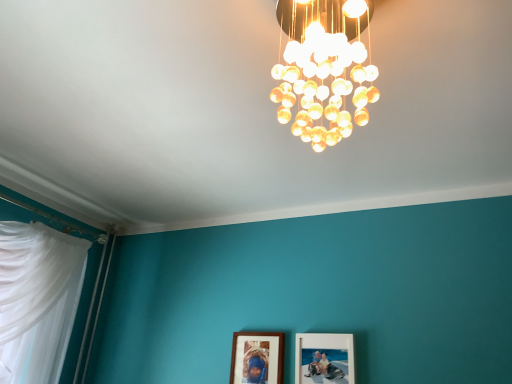
The height and width of the screenshot is (384, 512). Describe the element at coordinates (257, 357) in the screenshot. I see `wooden picture frame at center, the first picture frame when ordered from left to right` at that location.

This screenshot has height=384, width=512. I want to click on matte wooden picture frame at lower center, which appears as the second picture frame when viewed from the left, so click(x=324, y=356).

How many degrees apart are the facing directions of wooden picture frame at center, acting as the 2th picture frame starting from the right, and translucent glass chandelier at upper center?

The angular difference between wooden picture frame at center, acting as the 2th picture frame starting from the right, and translucent glass chandelier at upper center is 86.1 degrees.

Is wooden picture frame at center, the first picture frame when ordered from left to right, aimed at translucent glass chandelier at upper center?

No, wooden picture frame at center, the first picture frame when ordered from left to right, is not oriented towards translucent glass chandelier at upper center.

Which object is positioned more to the right, wooden picture frame at center, the first picture frame when ordered from left to right, or translucent glass chandelier at upper center?

From the viewer's perspective, translucent glass chandelier at upper center appears more on the right side.

From the image's perspective, is wooden picture frame at center, the first picture frame when ordered from left to right, beneath matte wooden picture frame at lower center, which is counted as the first picture frame, starting from the right?

Indeed, from the image's perspective, wooden picture frame at center, the first picture frame when ordered from left to right, is shown beneath matte wooden picture frame at lower center, which is counted as the first picture frame, starting from the right.

Is point (234, 334) closer or farther from the camera than point (342, 369)?

Point (234, 334).

Considering the positions of objects wooden picture frame at center, the first picture frame when ordered from left to right, and matte wooden picture frame at lower center, which appears as the second picture frame when viewed from the left, in the image provided, who is more to the right, wooden picture frame at center, the first picture frame when ordered from left to right, or matte wooden picture frame at lower center, which appears as the second picture frame when viewed from the left,?

From the viewer's perspective, matte wooden picture frame at lower center, which appears as the second picture frame when viewed from the left, appears more on the right side.

Is wooden picture frame at center, acting as the 2th picture frame starting from the right, located within matte wooden picture frame at lower center, which appears as the second picture frame when viewed from the left?

No, matte wooden picture frame at lower center, which appears as the second picture frame when viewed from the left, does not contain wooden picture frame at center, acting as the 2th picture frame starting from the right.

Is matte wooden picture frame at lower center, which appears as the second picture frame when viewed from the left, facing towards wooden picture frame at center, acting as the 2th picture frame starting from the right?

No.

Is matte wooden picture frame at lower center, which is counted as the first picture frame, starting from the right, smaller than wooden picture frame at center, the first picture frame when ordered from left to right?

Actually, matte wooden picture frame at lower center, which is counted as the first picture frame, starting from the right, might be larger than wooden picture frame at center, the first picture frame when ordered from left to right.

From a real-world perspective, is matte wooden picture frame at lower center, which appears as the second picture frame when viewed from the left, physically below wooden picture frame at center, the first picture frame when ordered from left to right?

No.

Between translucent glass chandelier at upper center and matte wooden picture frame at lower center, which is counted as the first picture frame, starting from the right, which one is positioned in front?

translucent glass chandelier at upper center is closer to the camera.

From a real-world perspective, is translucent glass chandelier at upper center on top of matte wooden picture frame at lower center, which is counted as the first picture frame, starting from the right?

Yes, from a real-world perspective, translucent glass chandelier at upper center is over matte wooden picture frame at lower center, which is counted as the first picture frame, starting from the right

Would you say translucent glass chandelier at upper center is inside or outside matte wooden picture frame at lower center, which appears as the second picture frame when viewed from the left?

translucent glass chandelier at upper center lies outside matte wooden picture frame at lower center, which appears as the second picture frame when viewed from the left.

How different are the orientations of translucent glass chandelier at upper center and matte wooden picture frame at lower center, which appears as the second picture frame when viewed from the left, in degrees?

The angle between the facing direction of translucent glass chandelier at upper center and the facing direction of matte wooden picture frame at lower center, which appears as the second picture frame when viewed from the left, is 86.6 degrees.

Considering the relative sizes of matte wooden picture frame at lower center, which appears as the second picture frame when viewed from the left, and translucent glass chandelier at upper center in the image provided, is matte wooden picture frame at lower center, which appears as the second picture frame when viewed from the left, smaller than translucent glass chandelier at upper center?

Yes.

From a real-world perspective, is matte wooden picture frame at lower center, which appears as the second picture frame when viewed from the left, physically above translucent glass chandelier at upper center?

No, from a real-world perspective, matte wooden picture frame at lower center, which appears as the second picture frame when viewed from the left, is not on top of translucent glass chandelier at upper center.

Is the position of matte wooden picture frame at lower center, which appears as the second picture frame when viewed from the left, less distant than that of translucent glass chandelier at upper center?

No, it is behind translucent glass chandelier at upper center.

What's the angular difference between matte wooden picture frame at lower center, which appears as the second picture frame when viewed from the left, and translucent glass chandelier at upper center's facing directions?

They differ by 86.6 degrees in their facing directions.

Is translucent glass chandelier at upper center completely or partially outside of wooden picture frame at center, acting as the 2th picture frame starting from the right?

Absolutely, translucent glass chandelier at upper center is external to wooden picture frame at center, acting as the 2th picture frame starting from the right.

Which of these two, translucent glass chandelier at upper center or wooden picture frame at center, the first picture frame when ordered from left to right, is thinner?

wooden picture frame at center, the first picture frame when ordered from left to right.

Between translucent glass chandelier at upper center and wooden picture frame at center, acting as the 2th picture frame starting from the right, which one has more height?

Standing taller between the two is translucent glass chandelier at upper center.

In the image, there is a wooden picture frame at center, acting as the 2th picture frame starting from the right. Identify the location of lamp above it (from the image's perspective). (324, 68).

The width and height of the screenshot is (512, 384). In order to click on picture frame behind the matte wooden picture frame at lower center, which is counted as the first picture frame, starting from the right in this screenshot , I will do `click(257, 357)`.

From the image, which object appears to be farther from translucent glass chandelier at upper center, wooden picture frame at center, acting as the 2th picture frame starting from the right, or matte wooden picture frame at lower center, which is counted as the first picture frame, starting from the right?

wooden picture frame at center, acting as the 2th picture frame starting from the right.

From the image, which object appears to be farther from matte wooden picture frame at lower center, which appears as the second picture frame when viewed from the left, translucent glass chandelier at upper center or wooden picture frame at center, the first picture frame when ordered from left to right?

translucent glass chandelier at upper center.

Which object lies further to the anchor point wooden picture frame at center, acting as the 2th picture frame starting from the right, translucent glass chandelier at upper center or matte wooden picture frame at lower center, which appears as the second picture frame when viewed from the left?

The object further to wooden picture frame at center, acting as the 2th picture frame starting from the right, is translucent glass chandelier at upper center.

Based on their spatial positions, is matte wooden picture frame at lower center, which is counted as the first picture frame, starting from the right, or wooden picture frame at center, the first picture frame when ordered from left to right, further from translucent glass chandelier at upper center?

wooden picture frame at center, the first picture frame when ordered from left to right, is positioned further to the anchor translucent glass chandelier at upper center.

Consider the image. From the image, which object appears to be nearer to wooden picture frame at center, the first picture frame when ordered from left to right, matte wooden picture frame at lower center, which appears as the second picture frame when viewed from the left, or translucent glass chandelier at upper center?

matte wooden picture frame at lower center, which appears as the second picture frame when viewed from the left, lies closer to wooden picture frame at center, the first picture frame when ordered from left to right, than the other object.

Considering their positions, is wooden picture frame at center, acting as the 2th picture frame starting from the right, positioned closer to matte wooden picture frame at lower center, which appears as the second picture frame when viewed from the left, than translucent glass chandelier at upper center?

A: wooden picture frame at center, acting as the 2th picture frame starting from the right, is closer to matte wooden picture frame at lower center, which appears as the second picture frame when viewed from the left.

Image resolution: width=512 pixels, height=384 pixels. I want to click on picture frame located between translucent glass chandelier at upper center and wooden picture frame at center, the first picture frame when ordered from left to right, in the depth direction, so click(324, 356).